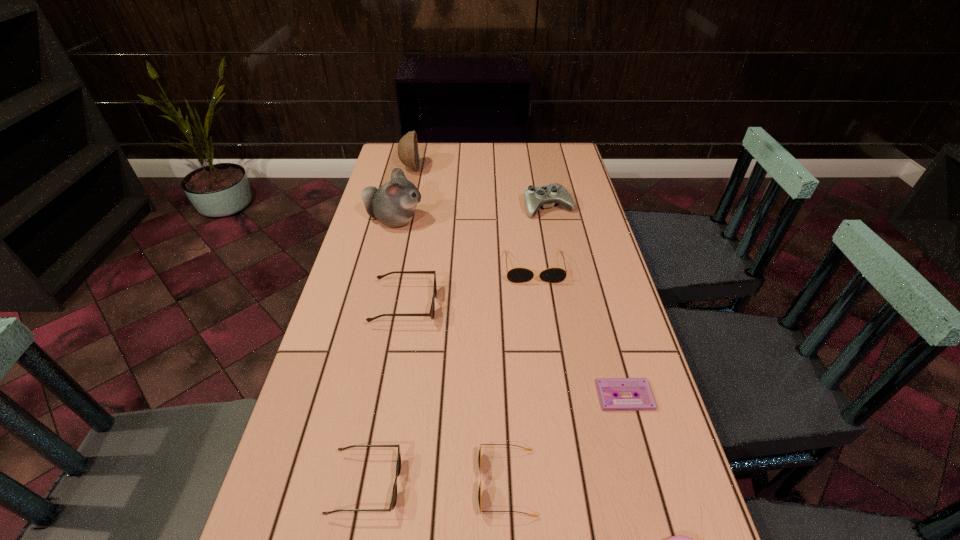
I want to click on object that is at the far edge, so click(x=408, y=154).

In order to click on hamster located in the left edge section of the desktop in this screenshot , I will do `click(394, 203)`.

Where is `bowl that is at the left edge`? This screenshot has width=960, height=540. bowl that is at the left edge is located at coordinates (408, 154).

You are a GUI agent. You are given a task and a screenshot of the screen. Output one action in this format:
    pyautogui.click(x=<x>, y=<y>)
    Task: Click on the control that is at the right edge
    Image resolution: width=960 pixels, height=540 pixels.
    Given the screenshot: What is the action you would take?
    pyautogui.click(x=546, y=196)

You are a GUI agent. You are given a task and a screenshot of the screen. Output one action in this format:
    pyautogui.click(x=<x>, y=<y>)
    Task: Click on the sunglasses present at the right edge
    
    Given the screenshot: What is the action you would take?
    pyautogui.click(x=516, y=275)

The image size is (960, 540). Identify the location of videotape that is at the right edge. (607, 388).

Find the location of a particular element. The image size is (960, 540). object at the far left corner is located at coordinates pyautogui.click(x=408, y=154).

Identify the location of vacant space at the far edge of the desktop. The width and height of the screenshot is (960, 540). (464, 148).

Identify the location of vacant space at the left edge of the desktop. (384, 172).

Image resolution: width=960 pixels, height=540 pixels. In order to click on free space at the right edge of the desktop in this screenshot , I will do `click(609, 292)`.